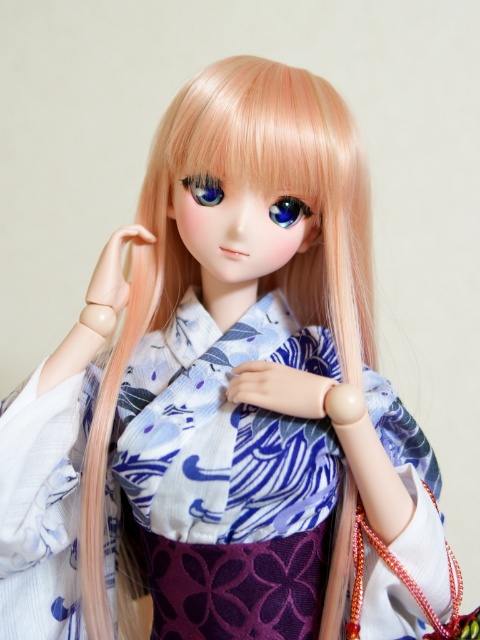
Is glossy blue eye at center shorter than blue glossy eye at center?

Correct, glossy blue eye at center is not as tall as blue glossy eye at center.

Between glossy blue eye at center and blue glossy eye at center, which one has more height?

Standing taller between the two is blue glossy eye at center.

Where is `glossy blue eye at center`? glossy blue eye at center is located at coordinates (288, 211).